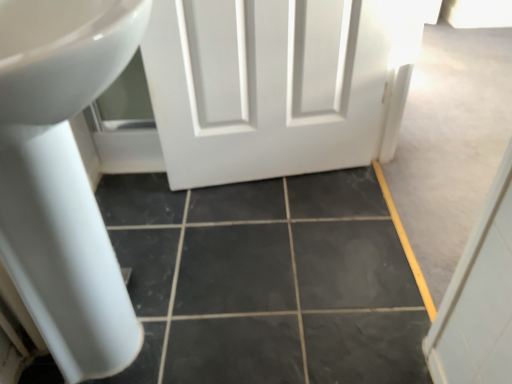
Question: Would you say white glossy sink at left is to the left or to the right of black marble tile at center in the picture?

Choices:
 (A) left
 (B) right

Answer: (A)

Question: Is white glossy sink at left wider or thinner than black marble tile at center?

Choices:
 (A) thin
 (B) wide

Answer: (A)

Question: Is point (100, 82) closer or farther from the camera than point (359, 334)?

Choices:
 (A) closer
 (B) farther

Answer: (A)

Question: In the image, is black marble tile at center positioned in front of or behind white glossy sink at left?

Choices:
 (A) front
 (B) behind

Answer: (B)

Question: From a real-world perspective, is black marble tile at center positioned above or below white glossy sink at left?

Choices:
 (A) above
 (B) below

Answer: (B)

Question: From the image's perspective, is black marble tile at center positioned above or below white glossy sink at left?

Choices:
 (A) below
 (B) above

Answer: (A)

Question: Considering the positions of black marble tile at center and white glossy sink at left in the image, is black marble tile at center wider or thinner than white glossy sink at left?

Choices:
 (A) wide
 (B) thin

Answer: (A)